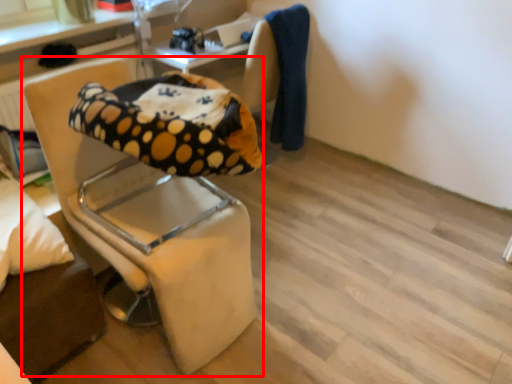
Question: Where is chair (annotated by the red box) located in relation to pillow in the image?

Choices:
 (A) left
 (B) right

Answer: (B)